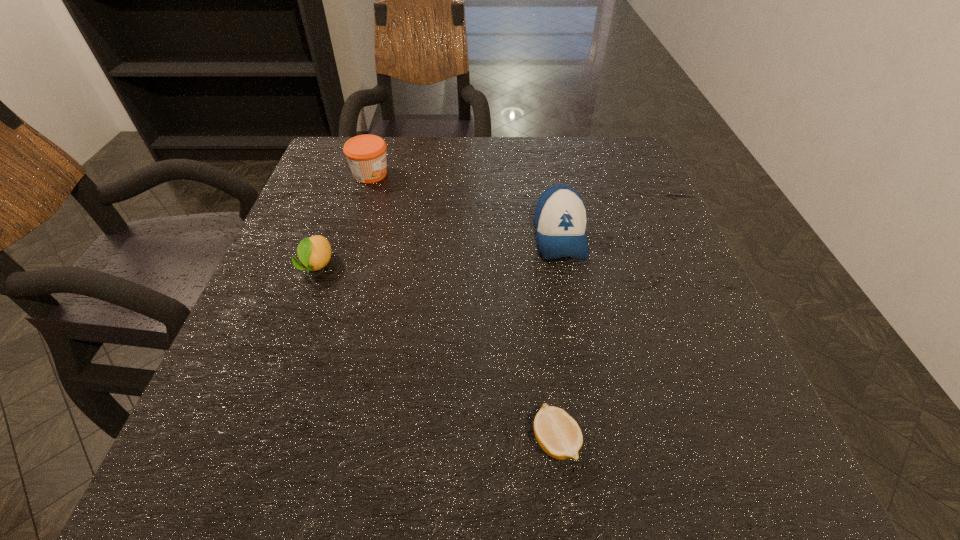
Where is `free region at the near right corner of the desktop`? free region at the near right corner of the desktop is located at coordinates (676, 460).

You are a GUI agent. You are given a task and a screenshot of the screen. Output one action in this format:
    pyautogui.click(x=<x>, y=<y>)
    Task: Click on the empty space between the baseball cap and the farthest object
    This screenshot has height=540, width=960.
    Given the screenshot: What is the action you would take?
    pyautogui.click(x=466, y=205)

Identify the location of vacant area that lies between the baseball cap and the right lemon. (558, 339).

Image resolution: width=960 pixels, height=540 pixels. What are the coordinates of `vacant space that's between the farthest object and the taller lemon` in the screenshot? It's located at (344, 220).

Where is `empty location between the jam and the baseball cap`? The image size is (960, 540). empty location between the jam and the baseball cap is located at coordinates pos(466,205).

Where is `vacant point located between the second tallest object and the shorter lemon`? vacant point located between the second tallest object and the shorter lemon is located at coordinates (463, 308).

The height and width of the screenshot is (540, 960). In order to click on vacant area that lies between the taller lemon and the right lemon in this screenshot , I will do `click(436, 353)`.

The width and height of the screenshot is (960, 540). I want to click on free space between the taller lemon and the baseball cap, so click(439, 251).

The image size is (960, 540). In order to click on vacant area that lies between the nearest object and the farthest object in this screenshot , I will do `click(463, 308)`.

Where is `vacant space that's between the right lemon and the third shortest object`? The width and height of the screenshot is (960, 540). vacant space that's between the right lemon and the third shortest object is located at coordinates (463, 308).